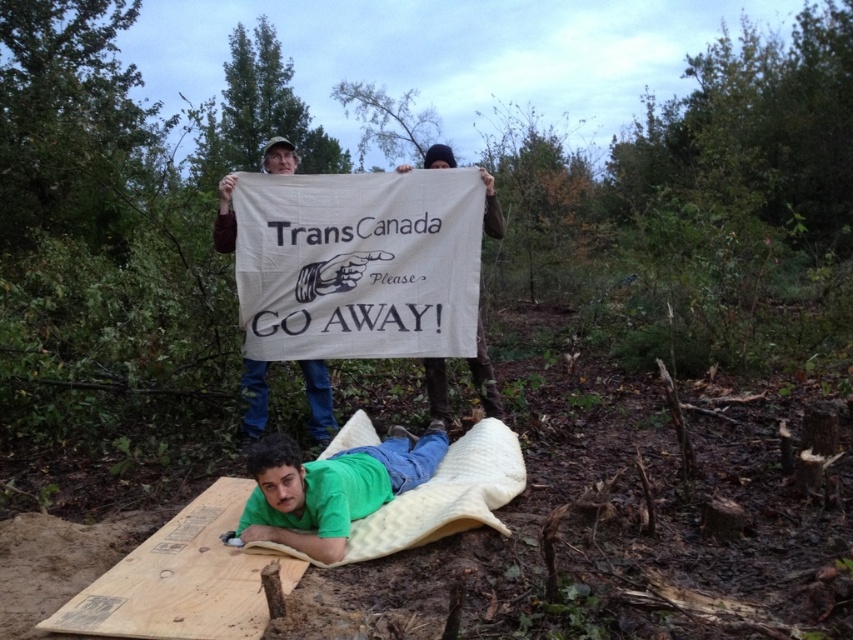
You are planning to build a small bench for a garden. You have the wooden plank at lower left and the brown cotton shirt at upper center. Which object is more suitable for constructing the bench?

The wooden plank at lower left is more suitable for constructing the bench because it has a larger size compared to the brown cotton shirt at upper center.